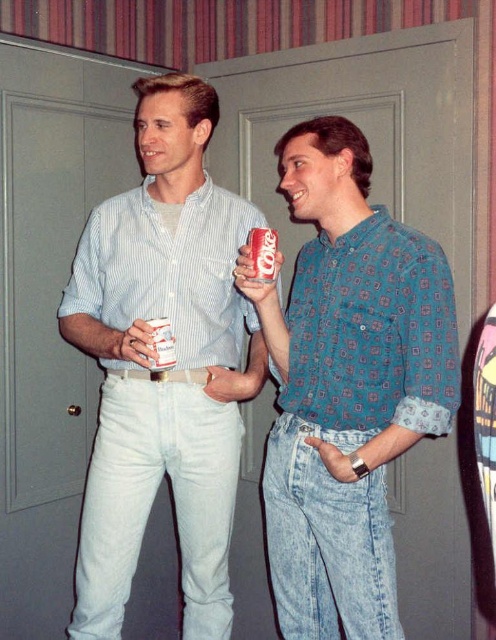
From the picture: You are a bartender who needs to pour a drink into the container that can hold more liquid. Which object should you choose between the matte plastic can at center and the white paper cup at center?

The matte plastic can at center has a larger size compared to the white paper cup at center, so you should choose the matte plastic can at center to hold more liquid.

You are a delivery person who needs to place a small package between the blue printed shirt at center and the matte plastic can at center. The package is 14 inches long. Will it fit in the space between them?

The distance between the blue printed shirt at center and the matte plastic can at center is 13.75 inches. Since the package is 14 inches long, it will not fit in the space between them as it is slightly longer than the available distance.